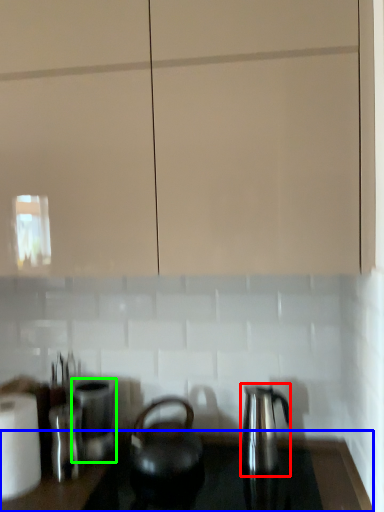
Question: Which is farther away from kettle (highlighted by a red box)? counter top (highlighted by a blue box) or appliance (highlighted by a green box)?

Choices:
 (A) counter top
 (B) appliance

Answer: (B)